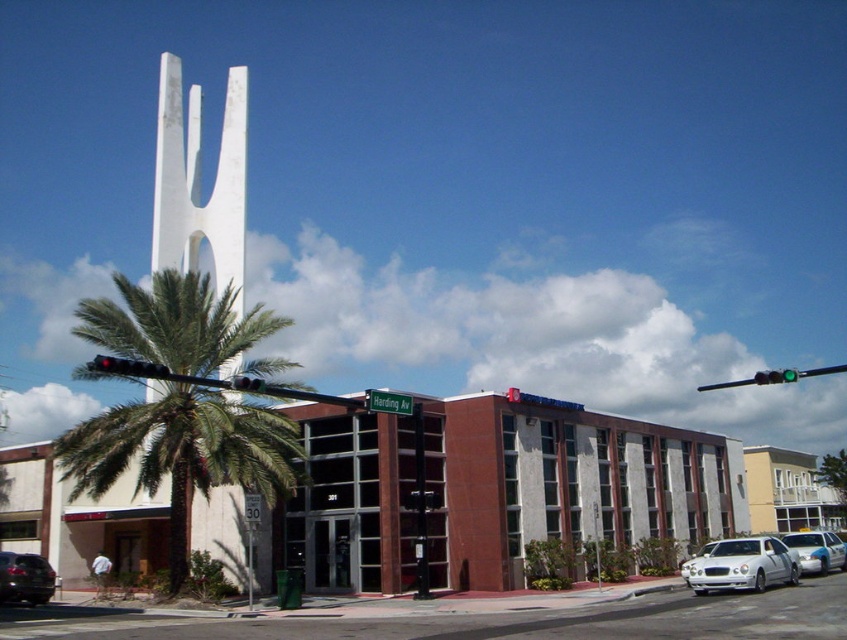
Which is more to the left, blue metallic sedan at center or black glass traffic light at upper center?

Positioned to the left is black glass traffic light at upper center.

Describe the element at coordinates (817, 550) in the screenshot. I see `blue metallic sedan at center` at that location.

This screenshot has width=847, height=640. Identify the location of blue metallic sedan at center. (817, 550).

Between matte black suv at lower left and green glass traffic light at upper right, which one is positioned lower?

Positioned lower is matte black suv at lower left.

Does matte black suv at lower left have a lesser width compared to green glass traffic light at upper right?

Yes, matte black suv at lower left is thinner than green glass traffic light at upper right.

Measure the distance between matte black suv at lower left and camera.

matte black suv at lower left is 25.76 meters from camera.

Where is `matte black suv at lower left`? matte black suv at lower left is located at coordinates (25, 579).

Who is higher up, green leafy palm tree at left or matte black suv at lower left?

Positioned higher is green leafy palm tree at left.

Does green leafy palm tree at left have a smaller size compared to matte black suv at lower left?

No.

Between point (95, 378) and point (21, 586), which one is positioned in front?

Positioned in front is point (95, 378).

The height and width of the screenshot is (640, 847). What are the coordinates of `green leafy palm tree at left` in the screenshot? It's located at (183, 452).